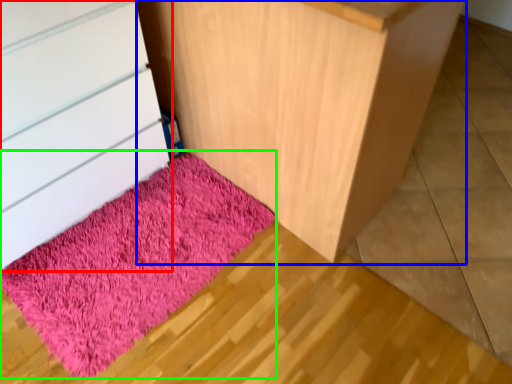
Question: Based on their relative distances, which object is nearer to chest of drawers (highlighted by a red box)? Choose from furniture (highlighted by a blue box) and mat (highlighted by a green box).

Choices:
 (A) furniture
 (B) mat

Answer: (B)